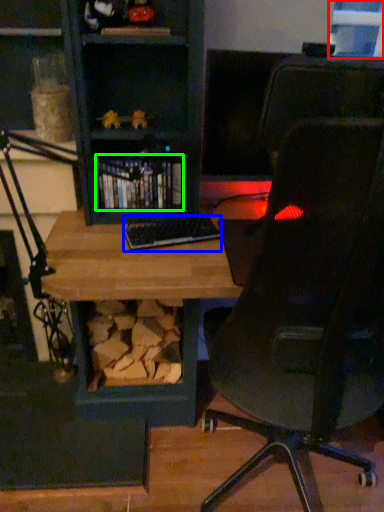
Question: Based on their relative distances, which object is farther from window (highlighted by a red box)? Choose from keyboard (highlighted by a blue box) and book (highlighted by a green box).

Choices:
 (A) keyboard
 (B) book

Answer: (A)